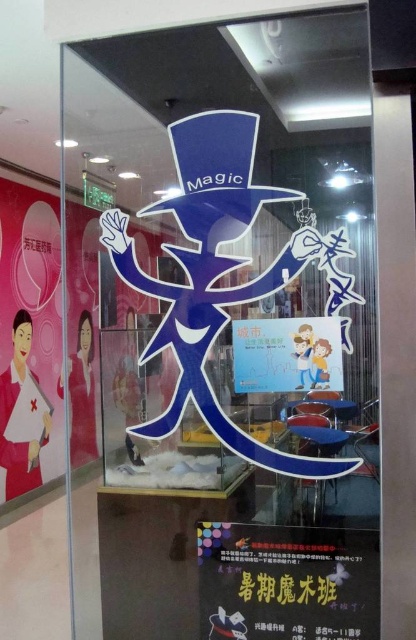
Does blue glossy magician at center have a larger size compared to matte black poster at lower center?

Correct, blue glossy magician at center is larger in size than matte black poster at lower center.

Can you confirm if blue glossy magician at center is positioned to the right of matte black poster at lower center?

Incorrect, blue glossy magician at center is not on the right side of matte black poster at lower center.

Is point (245, 176) less distant than point (309, 600)?

No, it is behind (309, 600).

This screenshot has height=640, width=416. Find the location of `blue glossy magician at center`. blue glossy magician at center is located at coordinates (220, 275).

In the scene shown: Which of these two, matte pink poster at left or matte paper poster at center, stands shorter?

matte paper poster at center is shorter.

Is point (14, 275) less distant than point (257, 346)?

No.

Find the location of a particular element. The height and width of the screenshot is (640, 416). matte pink poster at left is located at coordinates (29, 340).

Is matte black poster at lower center below matte pink poster at left?

Correct, matte black poster at lower center is located below matte pink poster at left.

Is matte black poster at lower center to the left of matte pink poster at left from the viewer's perspective?

Incorrect, matte black poster at lower center is not on the left side of matte pink poster at left.

Between point (371, 605) and point (37, 221), which one is positioned in front?

Point (371, 605)

Locate an element on the screen. Image resolution: width=416 pixels, height=640 pixels. matte black poster at lower center is located at coordinates (287, 582).